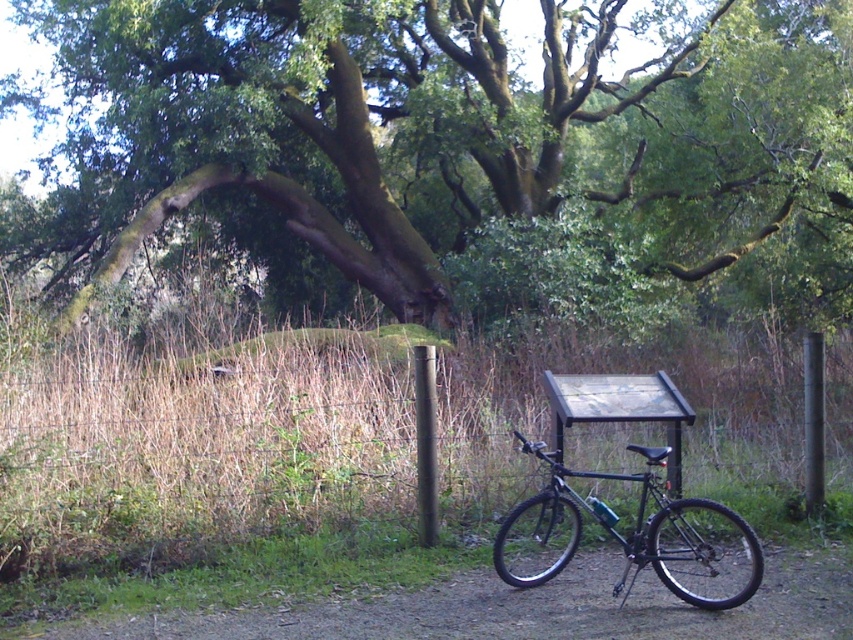
Question: Which point is farther to the camera?

Choices:
 (A) (425, 515)
 (B) (821, 348)

Answer: (B)

Question: Which point appears farthest from the camera in this image?

Choices:
 (A) pyautogui.click(x=534, y=499)
 (B) pyautogui.click(x=583, y=554)

Answer: (B)

Question: Does green mossy tree at upper center have a greater width compared to black metallic bicycle at lower right?

Choices:
 (A) no
 (B) yes

Answer: (B)

Question: Is green mossy tree at upper center smaller than black metallic pole at center?

Choices:
 (A) yes
 (B) no

Answer: (B)

Question: Which object is farther from the camera taking this photo?

Choices:
 (A) green mossy tree at upper center
 (B) dirt path at center
 (C) black metallic bicycle at lower right

Answer: (A)

Question: Can you confirm if black metallic pole at center is wider than smooth gray pole at right?

Choices:
 (A) no
 (B) yes

Answer: (A)